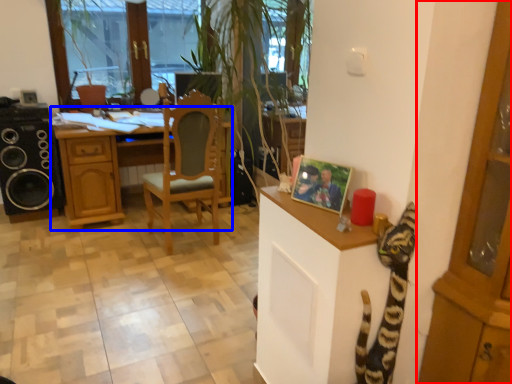
Question: Which object appears farthest to the camera in this image, cabinetry (highlighted by a red box) or desk (highlighted by a blue box)?

Choices:
 (A) cabinetry
 (B) desk

Answer: (B)